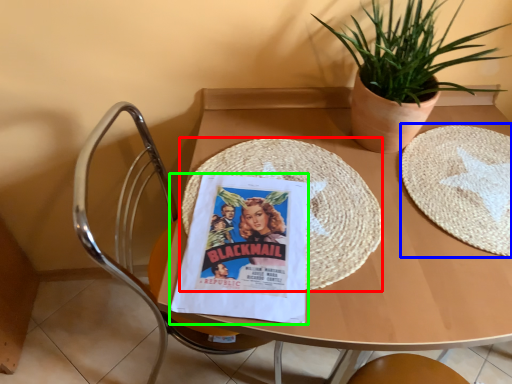
Question: Which object is the closest to the mat (highlighted by a red box)? Choose among these: paper plate (highlighted by a blue box) or comic book (highlighted by a green box).

Choices:
 (A) paper plate
 (B) comic book

Answer: (B)